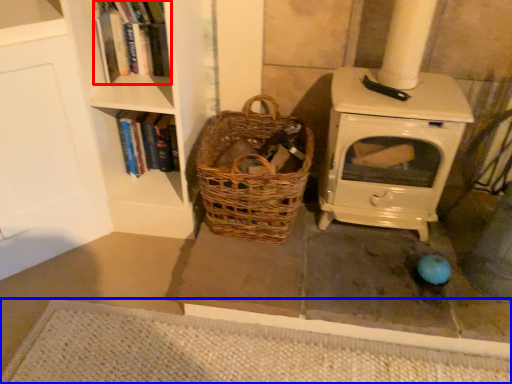
Question: Which point is closer to the camera, book (highlighted by a red box) or doormat (highlighted by a blue box)?

Choices:
 (A) book
 (B) doormat

Answer: (B)